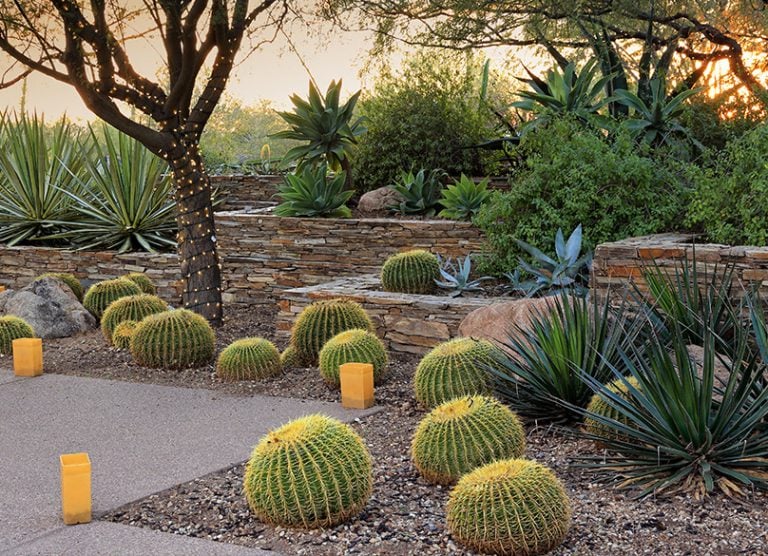
Find the location of a particular element. The height and width of the screenshot is (556, 768). wall is located at coordinates (263, 271).